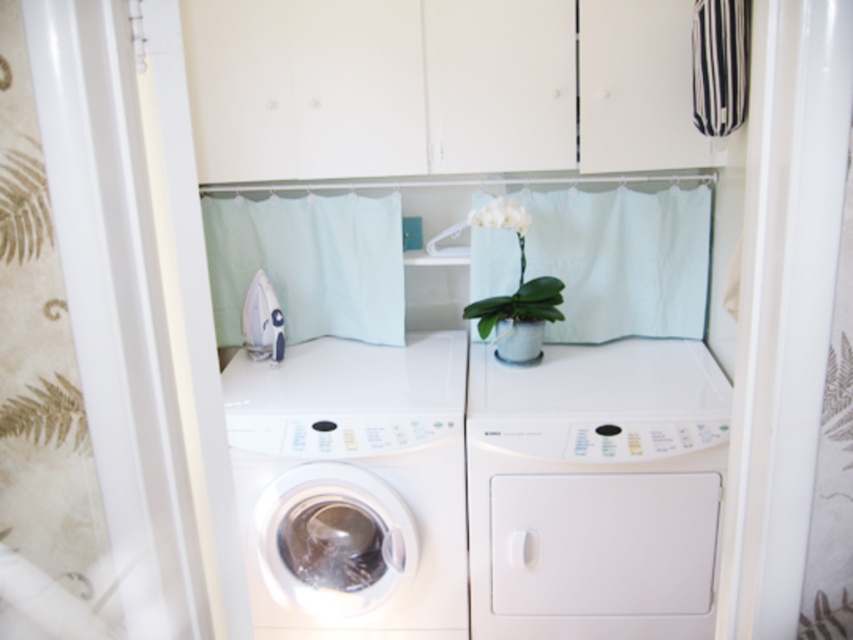
Is point (372, 237) positioned behind point (706, 67)?

Yes.

The height and width of the screenshot is (640, 853). In order to click on light blue fabric curtain at center in this screenshot , I will do `click(309, 264)`.

This screenshot has width=853, height=640. What do you see at coordinates (309, 264) in the screenshot?
I see `light blue fabric curtain at center` at bounding box center [309, 264].

Can you confirm if light blue fabric curtain at center is taller than matte white vase at center?

Correct, light blue fabric curtain at center is much taller as matte white vase at center.

Does point (344, 253) come in front of point (541, 339)?

That is False.

The width and height of the screenshot is (853, 640). Find the location of `light blue fabric curtain at center`. light blue fabric curtain at center is located at coordinates (309, 264).

Between white matte/texture dryer at center and matte white vase at center, which one is positioned higher?

matte white vase at center

Is white matte/texture dryer at center in front of matte white vase at center?

Yes, it is in front of matte white vase at center.

Which is behind, point (502, 385) or point (525, 328)?

Positioned behind is point (525, 328).

The width and height of the screenshot is (853, 640). Identify the location of white matte/texture dryer at center. pos(595,490).